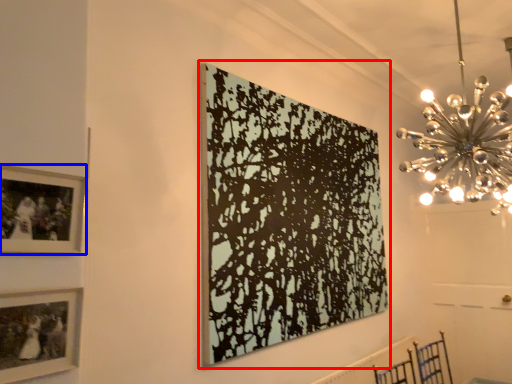
Question: Which object is closer to the camera taking this photo, picture frame (highlighted by a red box) or picture frame (highlighted by a blue box)?

Choices:
 (A) picture frame
 (B) picture frame

Answer: (B)